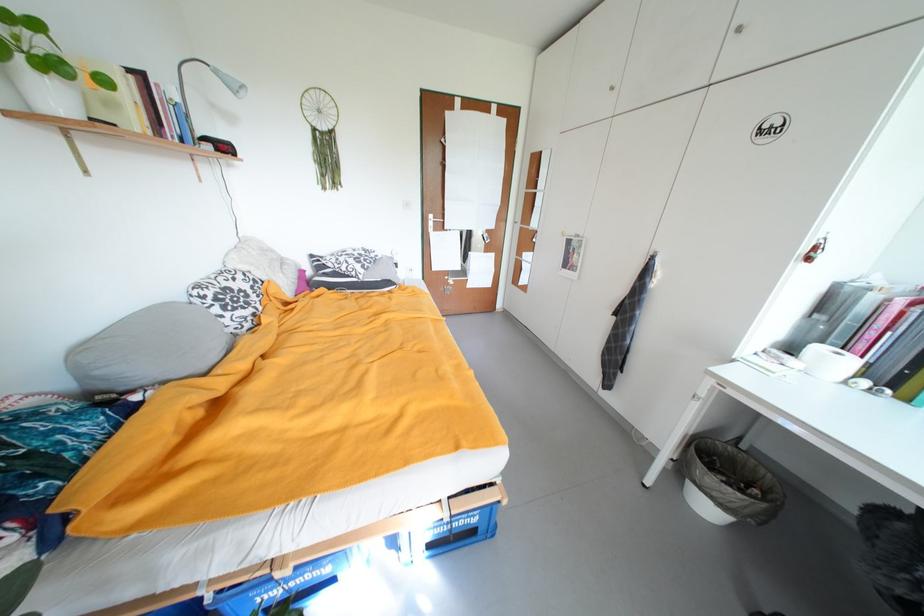
This screenshot has height=616, width=924. I want to click on white light switch, so click(407, 205).